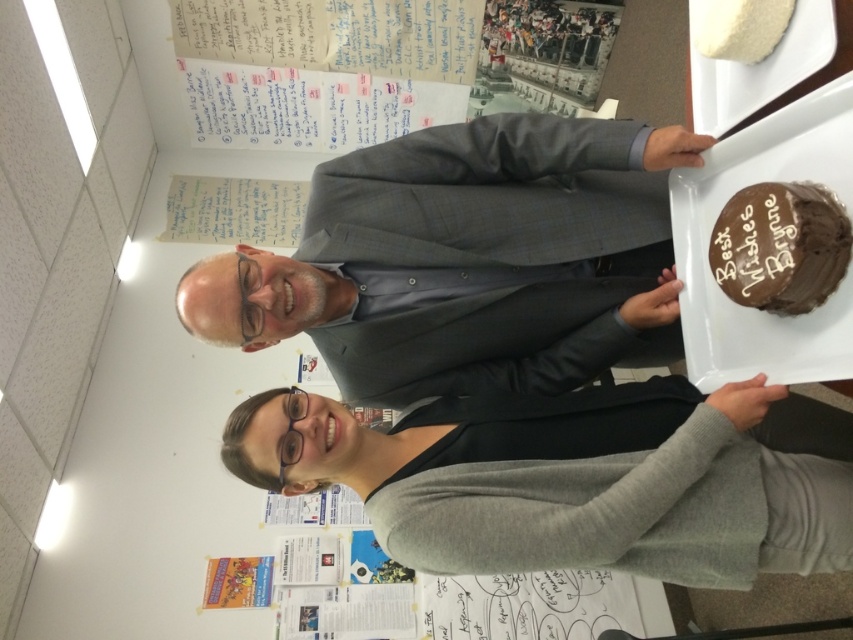
Is point (527, 364) less distant than point (531, 465)?

No, it is behind (531, 465).

Does matte gray suit at center come behind gray woolen business suit at center?

Yes, matte gray suit at center is behind gray woolen business suit at center.

Measure the distance between matte gray suit at center and camera.

matte gray suit at center is 3.73 feet from camera.

Find the location of a particular element. matte gray suit at center is located at coordinates (467, 260).

Is gray woolen business suit at center further to the viewer compared to chocolatesmoothcake at right?

Yes, gray woolen business suit at center is further from the viewer.

Measure the distance between gray woolen business suit at center and chocolatesmoothcake at right.

The distance of gray woolen business suit at center from chocolatesmoothcake at right is 14.07 inches.

Is point (473, 512) farther from camera compared to point (814, 289)?

Yes, it is behind point (814, 289).

Locate an element on the screen. Image resolution: width=853 pixels, height=640 pixels. gray woolen business suit at center is located at coordinates (641, 506).

Is point (490, 371) more distant than point (747, 259)?

Yes, it is.

Between point (456, 275) and point (814, 225), which one is positioned behind?

The point (456, 275) is more distant.

Between point (585, 163) and point (795, 262), which one is positioned in front?

Point (795, 262)

This screenshot has height=640, width=853. I want to click on matte gray suit at center, so click(467, 260).